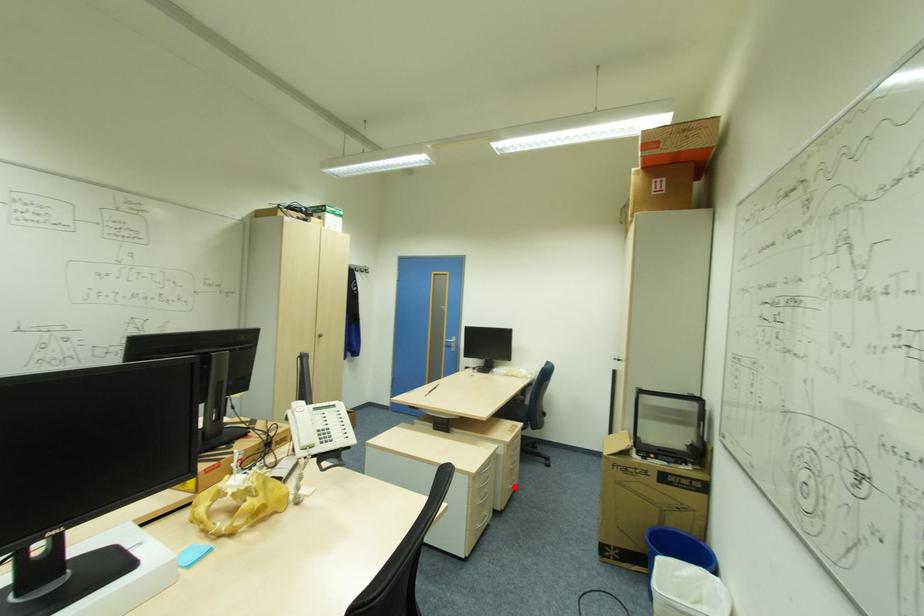
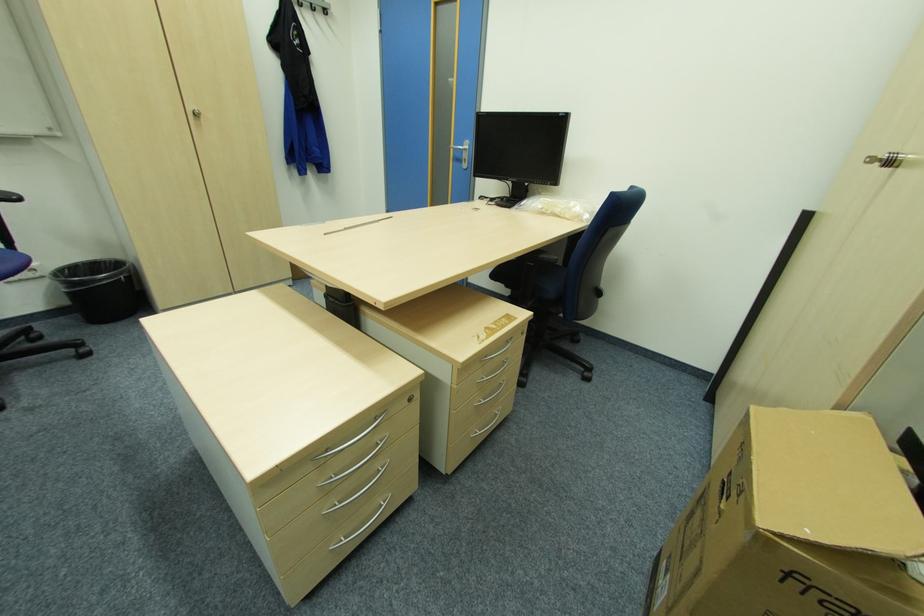
Locate, in the second image, the point that corresponds to the highlighted location in the first image.

(482, 432)